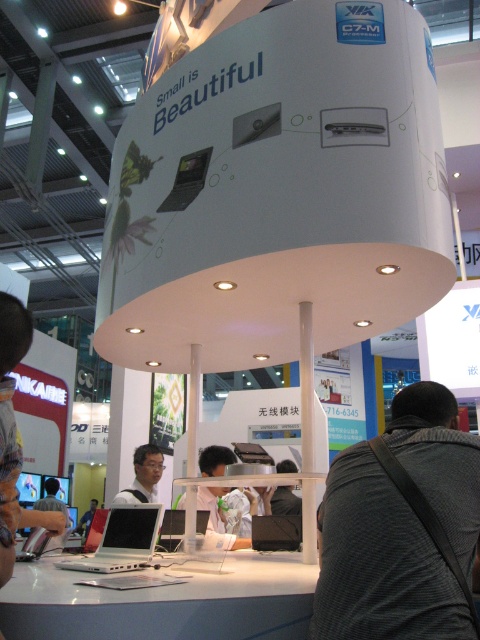
You are a photographer at the exhibition and want to take a photo of the dark gray fabric shirt at center without the black textured jacket at lower right blocking it. How should you adjust your position?

Move to the side opposite of the black textured jacket at lower right so that the dark gray fabric shirt at center becomes visible without obstruction from the jacket.

You are a photographer at the exhibition and want to capture both the black textured jacket at lower right and the dark gray fabric shirt at center in a single frame. Since you can adjust the camera focus, which item should you focus on first to ensure both are in the frame?

The black textured jacket at lower right is bigger than the dark gray fabric shirt at center, so you should focus on the black textured jacket at lower right first to ensure both are in the frame.